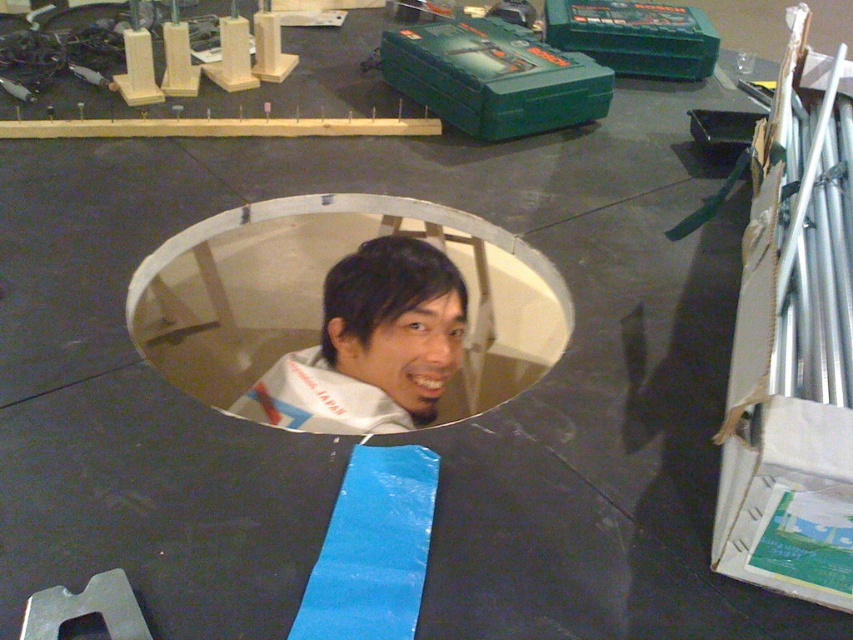
Question: In this image, where is white plastic hole at center located relative to white fabric at center?

Choices:
 (A) left
 (B) right

Answer: (A)

Question: Which object is closer to the camera taking this photo?

Choices:
 (A) white fabric at center
 (B) white plastic hole at center

Answer: (B)

Question: Which point appears closest to the camera in this image?

Choices:
 (A) (312, 365)
 (B) (263, 365)

Answer: (A)

Question: In this image, where is white plastic hole at center located relative to white fabric at center?

Choices:
 (A) right
 (B) left

Answer: (B)

Question: Which point is closer to the camera?

Choices:
 (A) white plastic hole at center
 (B) white fabric at center

Answer: (A)

Question: Is white plastic hole at center thinner than white fabric at center?

Choices:
 (A) no
 (B) yes

Answer: (A)